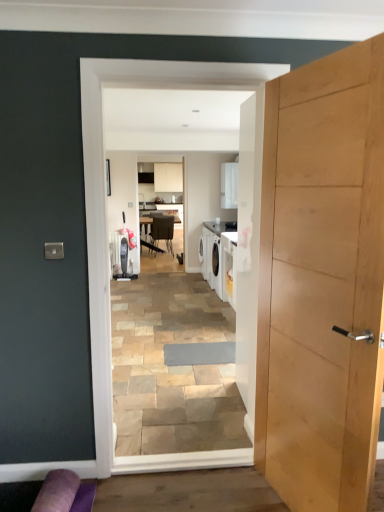
Question: Does light wood door at right have a larger size compared to metallic silver chair at center?

Choices:
 (A) no
 (B) yes

Answer: (B)

Question: Does light wood door at right have a lesser height compared to metallic silver chair at center?

Choices:
 (A) yes
 (B) no

Answer: (B)

Question: Does light wood door at right have a lesser width compared to metallic silver chair at center?

Choices:
 (A) yes
 (B) no

Answer: (A)

Question: Is light wood door at right behind metallic silver chair at center?

Choices:
 (A) yes
 (B) no

Answer: (B)

Question: From a real-world perspective, does light wood door at right sit lower than metallic silver chair at center?

Choices:
 (A) no
 (B) yes

Answer: (A)

Question: From a real-world perspective, is light wood door at right over metallic silver chair at center?

Choices:
 (A) no
 (B) yes

Answer: (B)

Question: From a real-world perspective, is purple fabric couch at lower left physically above white glossy laundry machine at center?

Choices:
 (A) no
 (B) yes

Answer: (A)

Question: Does purple fabric couch at lower left have a smaller size compared to white glossy laundry machine at center?

Choices:
 (A) yes
 (B) no

Answer: (A)

Question: Does purple fabric couch at lower left touch white glossy laundry machine at center?

Choices:
 (A) no
 (B) yes

Answer: (A)

Question: Is purple fabric couch at lower left aimed at white glossy laundry machine at center?

Choices:
 (A) no
 (B) yes

Answer: (A)

Question: Does purple fabric couch at lower left lie behind white glossy laundry machine at center?

Choices:
 (A) no
 (B) yes

Answer: (A)

Question: Considering the relative positions of purple fabric couch at lower left and white glossy laundry machine at center in the image provided, is purple fabric couch at lower left to the left of white glossy laundry machine at center from the viewer's perspective?

Choices:
 (A) yes
 (B) no

Answer: (A)

Question: From a real-world perspective, does white glossy laundry machine at center sit lower than light wood door at right?

Choices:
 (A) no
 (B) yes

Answer: (A)